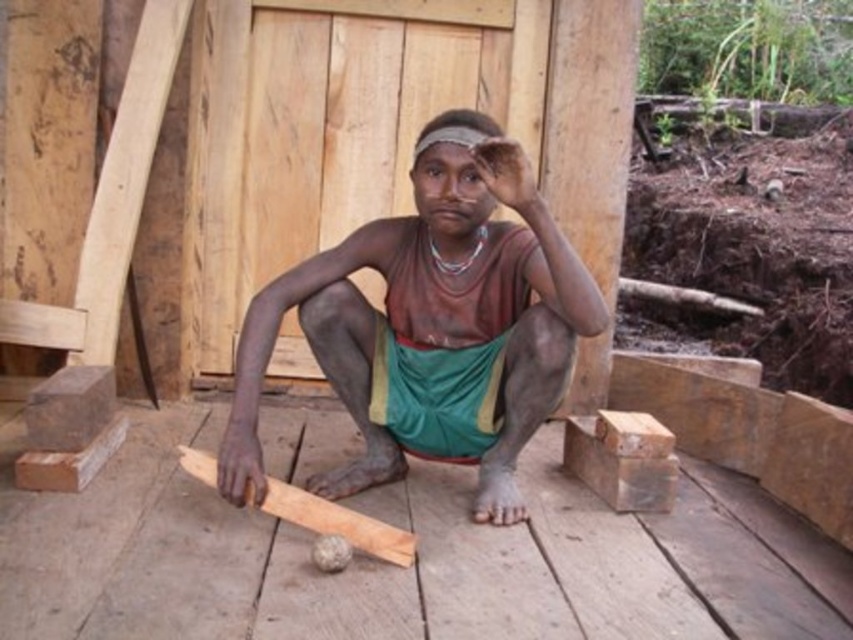
Question: Which is nearer to the brown wood plank at lower center?

Choices:
 (A) brown matte wood at center
 (B) dry skin at center

Answer: (A)

Question: Which point is farther to the camera?

Choices:
 (A) (254, 467)
 (B) (378, 262)
 (C) (498, 163)

Answer: (B)

Question: Which of the following is the farthest from the observer?

Choices:
 (A) brown matte wood at center
 (B) dry skin at center
 (C) brown wood plank at lower center

Answer: (C)

Question: Is brown matte wood at center closer to camera compared to brown wood plank at lower center?

Choices:
 (A) yes
 (B) no

Answer: (A)

Question: Considering the relative positions of brown wood plank at lower center and dry skin at center in the image provided, where is brown wood plank at lower center located with respect to dry skin at center?

Choices:
 (A) below
 (B) above

Answer: (A)

Question: Is brown matte wood at center below dry skin at center?

Choices:
 (A) no
 (B) yes

Answer: (B)